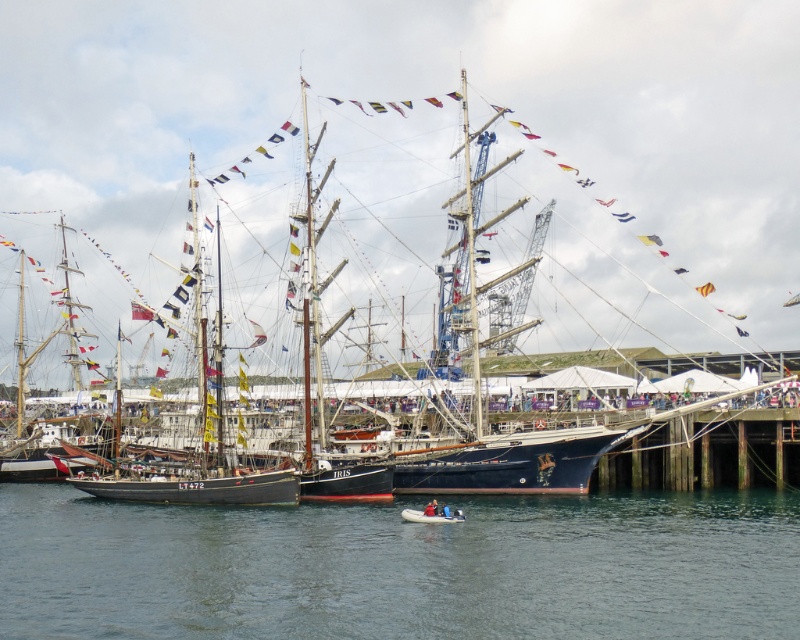
You are a photographer planning to capture the harbor scene. You need to ensure that the clear blue water at center and the rubber dinghy at lower center are both visible in your shot. Given their sizes, which object should you focus on to include both in the frame?

The clear blue water at center has a larger size compared to the rubber dinghy at lower center. To include both in the frame, focus on the larger clear blue water at center and adjust the camera angle to ensure the smaller rubber dinghy at lower center is also visible.

You are a photographer standing on the dock and want to take a photo of the dark blue wooden ship at center and the rubber dinghy at lower center. Which object should you position to the right side of your frame to include both in the photo?

You should position the rubber dinghy at lower center to the right side of your frame because the dark blue wooden ship at center is to the left of the rubber dinghy at lower center.